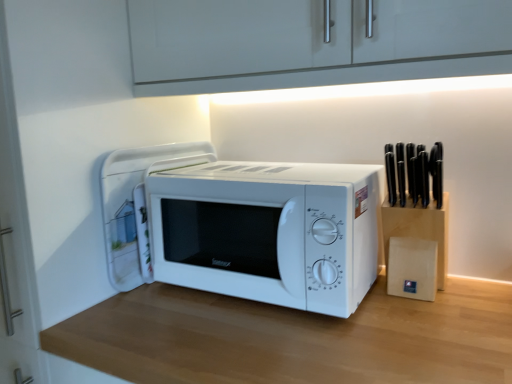
Question: Is point (370, 196) closer or farther from the camera than point (373, 299)?

Choices:
 (A) closer
 (B) farther

Answer: (A)

Question: Looking at the image, does white matte microwave at center seem bigger or smaller compared to wooden table at center?

Choices:
 (A) small
 (B) big

Answer: (A)

Question: Considering the real-world distances, which object is farthest from the white glossy microwave at center?

Choices:
 (A) white matte microwave at center
 (B) wooden table at center

Answer: (B)

Question: Based on their relative distances, which object is nearer to the white matte microwave at center?

Choices:
 (A) white glossy microwave at center
 (B) wooden table at center

Answer: (B)